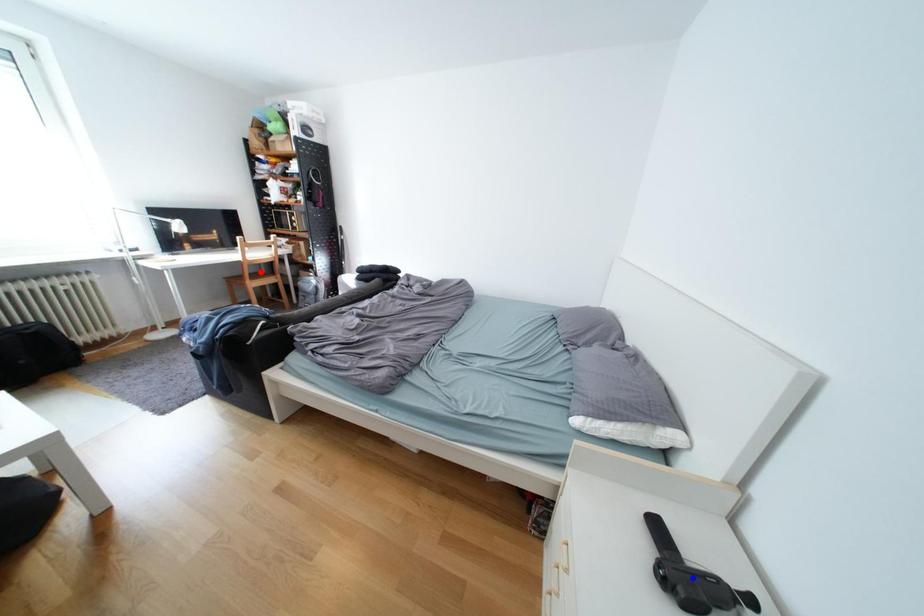
Question: Two points are marked on the image. Which point is closer to the camera?

Choices:
 (A) Blue point is closer.
 (B) Red point is closer.

Answer: (A)